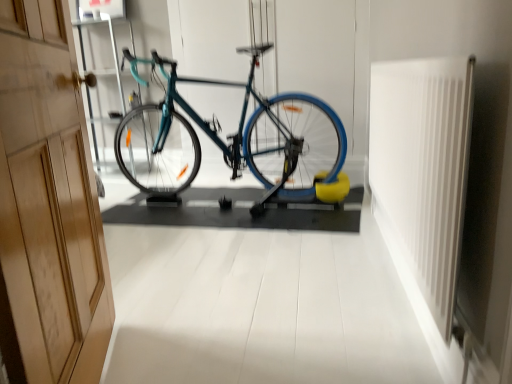
Question: Does wooden at left have a larger size compared to teal glossy bicycle at center?

Choices:
 (A) yes
 (B) no

Answer: (B)

Question: Does wooden at left have a smaller size compared to teal glossy bicycle at center?

Choices:
 (A) yes
 (B) no

Answer: (A)

Question: Is the position of wooden at left more distant than that of teal glossy bicycle at center?

Choices:
 (A) yes
 (B) no

Answer: (B)

Question: Can you confirm if wooden at left is shorter than teal glossy bicycle at center?

Choices:
 (A) no
 (B) yes

Answer: (A)

Question: Is wooden at left facing towards teal glossy bicycle at center?

Choices:
 (A) yes
 (B) no

Answer: (A)

Question: Considering the positions of teal glossy bicycle at center and wooden at left in the image, is teal glossy bicycle at center bigger or smaller than wooden at left?

Choices:
 (A) big
 (B) small

Answer: (A)

Question: Considering the positions of teal glossy bicycle at center and wooden at left in the image, is teal glossy bicycle at center taller or shorter than wooden at left?

Choices:
 (A) tall
 (B) short

Answer: (B)

Question: Is point (314, 185) positioned closer to the camera than point (3, 28)?

Choices:
 (A) farther
 (B) closer

Answer: (A)

Question: Is teal glossy bicycle at center in front of or behind wooden at left in the image?

Choices:
 (A) front
 (B) behind

Answer: (B)

Question: From their relative heights in the image, would you say white plastic radiator at right is taller or shorter than teal glossy bicycle at center?

Choices:
 (A) tall
 (B) short

Answer: (B)

Question: Would you say white plastic radiator at right is to the left or to the right of teal glossy bicycle at center in the picture?

Choices:
 (A) right
 (B) left

Answer: (A)

Question: Considering the positions of white plastic radiator at right and teal glossy bicycle at center in the image, is white plastic radiator at right bigger or smaller than teal glossy bicycle at center?

Choices:
 (A) big
 (B) small

Answer: (B)

Question: Is white plastic radiator at right spatially inside teal glossy bicycle at center, or outside of it?

Choices:
 (A) outside
 (B) inside

Answer: (A)

Question: Considering the positions of point (310, 190) and point (409, 254), is point (310, 190) closer or farther from the camera than point (409, 254)?

Choices:
 (A) farther
 (B) closer

Answer: (A)

Question: Based on their positions, is teal glossy bicycle at center located to the left or right of white plastic radiator at right?

Choices:
 (A) left
 (B) right

Answer: (A)